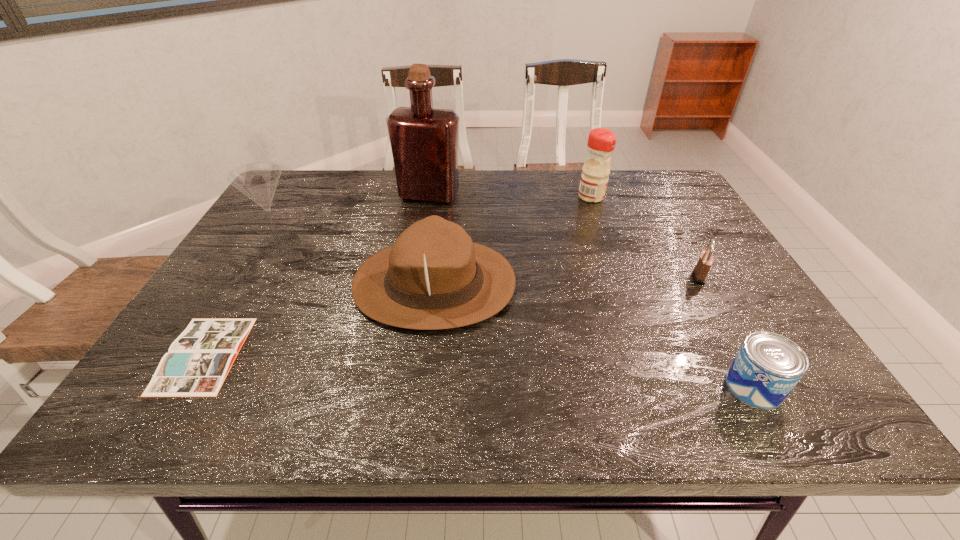
Identify which object is located as the fourth nearest to the book. Please provide its 2D coordinates. Your answer should be formatted as a tuple, i.e. [(x, y)], where the tuple contains the x and y coordinates of a point satisfying the conditions above.

[(595, 173)]

This screenshot has height=540, width=960. Find the location of `free space that satisfies the following two spatial constraints: 1. on the front side of the third object from right to left; 2. on the left side of the padlock`. free space that satisfies the following two spatial constraints: 1. on the front side of the third object from right to left; 2. on the left side of the padlock is located at coordinates (620, 276).

Find the location of a particular element. vacant space that satisfies the following two spatial constraints: 1. on the front side of the third object from right to left; 2. on the feather side of the fedora is located at coordinates (623, 284).

At what (x,y) coordinates should I click in order to perform the action: click on free location that satisfies the following two spatial constraints: 1. on the front side of the padlock; 2. on the left side of the flute glass. Please return your answer as a coordinate pair (x, y). This screenshot has height=540, width=960. Looking at the image, I should click on (261, 276).